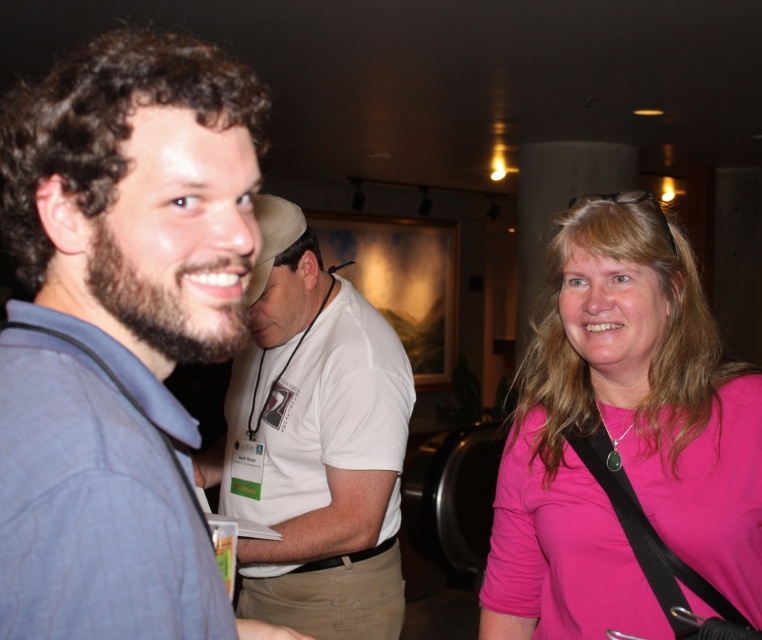
Where is the white cotton shirt at center located in the image?

The white cotton shirt at center is located at point (314, 444).

You are organizing a clothing donation drive and need to categorize shirts by size. You have a white cotton shirt at center and a blue cotton shirt at left. Which shirt should you place in the larger size bin?

The white cotton shirt at center should be placed in the larger size bin because its width is greater than the blue cotton shirt at left.